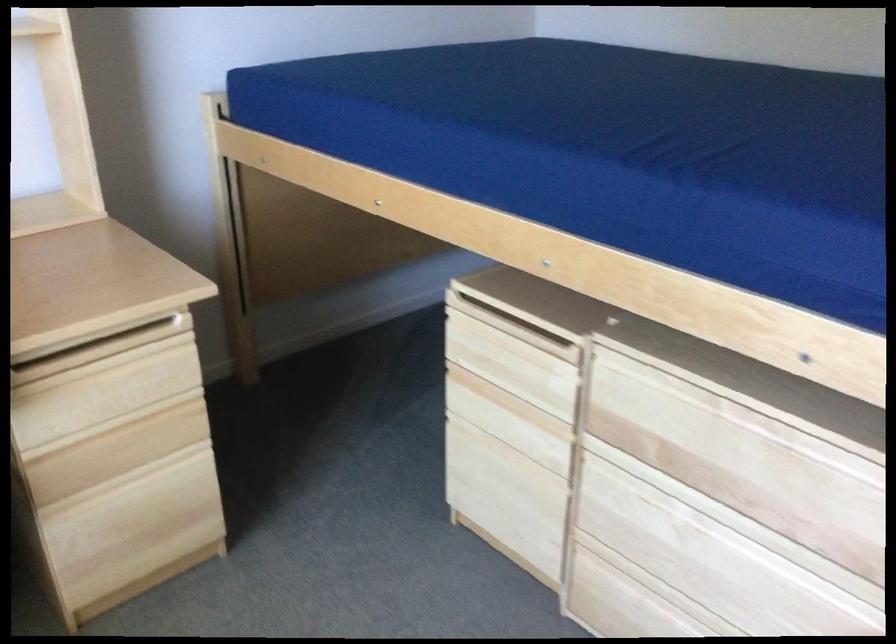
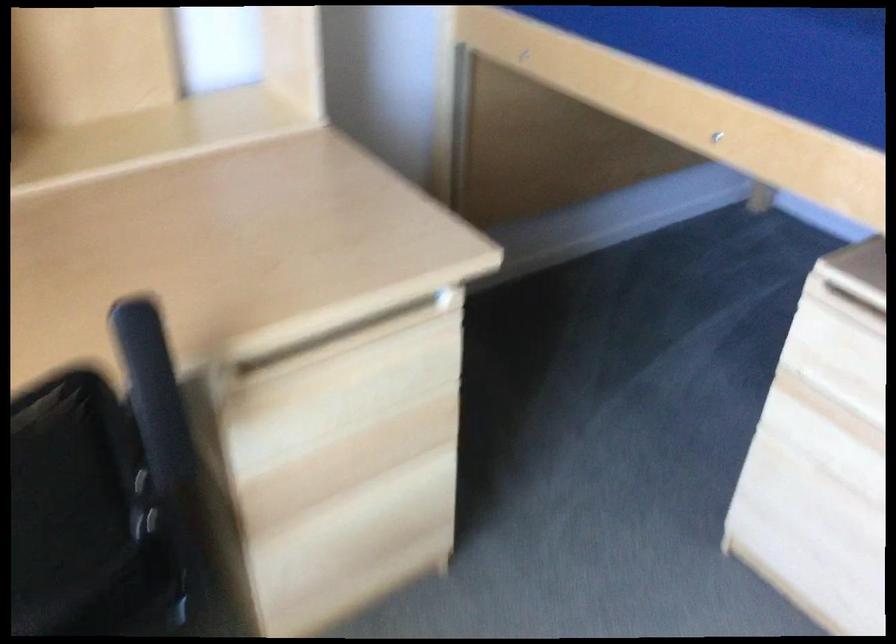
In a continuous first-person perspective shot, in which direction is the camera moving?

The cameraman moved toward left, forward.